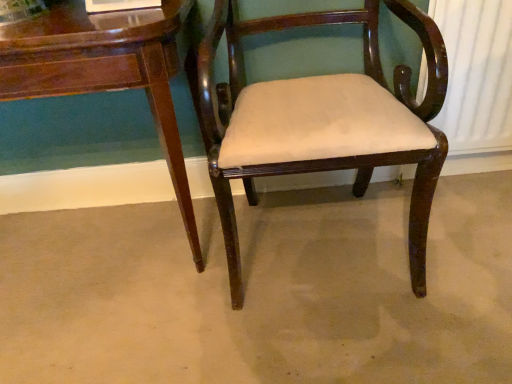
Identify the location of glossy wood table at lower left. This screenshot has width=512, height=384. (105, 70).

Find the location of a particular element. Image resolution: width=512 pixels, height=384 pixels. glossy wood table at lower left is located at coordinates (105, 70).

Does glossy wood table at lower left appear on the left side of mahogany wood chair at center?

Indeed, glossy wood table at lower left is positioned on the left side of mahogany wood chair at center.

Is glossy wood table at lower left taller or shorter than mahogany wood chair at center?

In the image, glossy wood table at lower left appears to be shorter than mahogany wood chair at center.

What's the angular difference between glossy wood table at lower left and mahogany wood chair at center's facing directions?

0.000332 degrees.

Between brown wood chair at center and mahogany wood chair at center, which one has larger size?

mahogany wood chair at center.

Is brown wood chair at center looking in the opposite direction of mahogany wood chair at center?

No, mahogany wood chair at center is not at the back of brown wood chair at center.

From a real-world perspective, is brown wood chair at center positioned under mahogany wood chair at center based on gravity?

Yes.

Considering the positions of points (476, 283) and (206, 56), is point (476, 283) closer to camera compared to point (206, 56)?

No, (476, 283) is further to viewer.

From a real-world perspective, is mahogany wood chair at center physically located above or below brown wood chair at center?

Clearly, from a real-world perspective, mahogany wood chair at center is above brown wood chair at center.

Which is behind, point (362, 172) or point (455, 190)?

Positioned behind is point (455, 190).

Can you confirm if mahogany wood chair at center is taller than brown wood chair at center?

Yes.

Between mahogany wood chair at center and brown wood chair at center, which one has smaller size?

With smaller size is brown wood chair at center.

Is mahogany wood chair at center oriented away from glossy wood table at lower left?

mahogany wood chair at center is not turned away from glossy wood table at lower left.

Based on the photo, can you tell me how much mahogany wood chair at center and glossy wood table at lower left differ in facing direction?

0.000332 degrees.

The height and width of the screenshot is (384, 512). Find the location of `chair in front of the glossy wood table at lower left`. chair in front of the glossy wood table at lower left is located at coordinates (332, 151).

Which is behind, mahogany wood chair at center or glossy wood table at lower left?

glossy wood table at lower left.

Based on the photo, how different are the orientations of brown wood chair at center and glossy wood table at lower left in degrees?

The facing directions of brown wood chair at center and glossy wood table at lower left are 89.9 degrees apart.

Is brown wood chair at center in front of glossy wood table at lower left?

No.

Is point (312, 199) positioned in front of point (98, 72)?

No.

Which is correct: glossy wood table at lower left is inside brown wood chair at center, or outside of it?

glossy wood table at lower left is outside brown wood chair at center.

Which object is thinner, glossy wood table at lower left or brown wood chair at center?

Thinner between the two is glossy wood table at lower left.

From the image's perspective, which is below, glossy wood table at lower left or brown wood chair at center?

brown wood chair at center, from the image's perspective.

Is glossy wood table at lower left placed right next to brown wood chair at center?

No, glossy wood table at lower left is not making contact with brown wood chair at center.

The width and height of the screenshot is (512, 384). I want to click on table that appears behind the mahogany wood chair at center, so click(105, 70).

At what (x,y) coordinates should I click in order to perform the action: click on concrete lying on the left of mahogany wood chair at center. Please return your answer as a coordinate pair (x, y). Looking at the image, I should click on (263, 291).

Considering their positions, is mahogany wood chair at center positioned further to glossy wood table at lower left than brown wood chair at center?

brown wood chair at center is further to glossy wood table at lower left.

In the scene shown: When comparing their distances from mahogany wood chair at center, does glossy wood table at lower left or brown wood chair at center seem further?

brown wood chair at center is positioned further to the anchor mahogany wood chair at center.

Considering their positions, is glossy wood table at lower left positioned closer to brown wood chair at center than mahogany wood chair at center?

mahogany wood chair at center lies closer to brown wood chair at center than the other object.

Looking at the image, which one is located further to brown wood chair at center, mahogany wood chair at center or glossy wood table at lower left?

glossy wood table at lower left.

From the image, which object appears to be nearer to mahogany wood chair at center, brown wood chair at center or glossy wood table at lower left?

glossy wood table at lower left.

From the picture: Which object lies nearer to the anchor point glossy wood table at lower left, brown wood chair at center or mahogany wood chair at center?

mahogany wood chair at center is closer to glossy wood table at lower left.

You are a GUI agent. You are given a task and a screenshot of the screen. Output one action in this format:
    pyautogui.click(x=<x>, y=<y>)
    Task: Click on the concrete situated between glossy wood table at lower left and mahogany wood chair at center from left to right
    
    Given the screenshot: What is the action you would take?
    pyautogui.click(x=263, y=291)